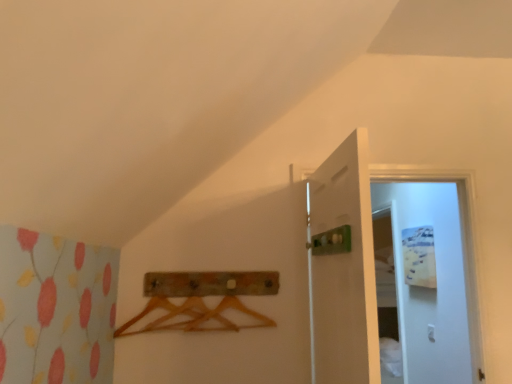
Question: Does white glossy door at upper right, the second door viewed from the left, appear on the left side of white matte door at center, placed as the 2th door when sorted from right to left?

Choices:
 (A) yes
 (B) no

Answer: (B)

Question: Is the depth of white glossy door at upper right, the first door viewed from the right, less than that of white matte door at center, the 1th door in the left-to-right sequence?

Choices:
 (A) yes
 (B) no

Answer: (B)

Question: Is white glossy door at upper right, the second door viewed from the left, positioned with its back to white matte door at center, the 1th door in the left-to-right sequence?

Choices:
 (A) no
 (B) yes

Answer: (A)

Question: From the image's perspective, is white glossy door at upper right, the second door viewed from the left, under white matte door at center, placed as the 2th door when sorted from right to left?

Choices:
 (A) yes
 (B) no

Answer: (A)

Question: Can you confirm if white glossy door at upper right, the second door viewed from the left, is taller than white matte door at center, the 1th door in the left-to-right sequence?

Choices:
 (A) no
 (B) yes

Answer: (B)

Question: Would you say white glossy door at upper right, the first door viewed from the right, contains wooden coat hanger at center?

Choices:
 (A) yes
 (B) no

Answer: (B)

Question: Is white glossy door at upper right, the first door viewed from the right, to the right of wooden coat hanger at center from the viewer's perspective?

Choices:
 (A) yes
 (B) no

Answer: (A)

Question: Does white glossy door at upper right, the second door viewed from the left, appear on the left side of wooden coat hanger at center?

Choices:
 (A) yes
 (B) no

Answer: (B)

Question: Considering the relative sizes of white glossy door at upper right, the first door viewed from the right, and wooden coat hanger at center in the image provided, is white glossy door at upper right, the first door viewed from the right, taller than wooden coat hanger at center?

Choices:
 (A) yes
 (B) no

Answer: (A)

Question: Does white glossy door at upper right, the second door viewed from the left, have a lesser width compared to wooden coat hanger at center?

Choices:
 (A) yes
 (B) no

Answer: (B)

Question: Is white glossy door at upper right, the first door viewed from the right, positioned before wooden coat hanger at center?

Choices:
 (A) yes
 (B) no

Answer: (A)

Question: Can you confirm if wooden coat hanger at center is positioned to the left of white glossy door at upper right, the first door viewed from the right?

Choices:
 (A) no
 (B) yes

Answer: (B)